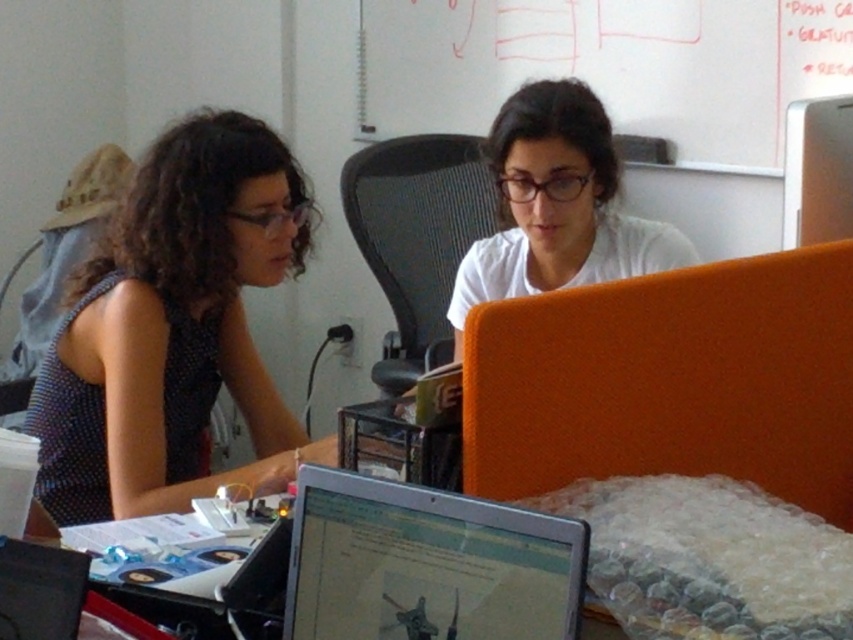
You are organizing a clothing donation drive and need to determine which shirt takes up more space. Based on the image, which of the two shirts, the polka dot fabric shirt at left or the white matte shirt at center, is bigger in size?

The polka dot fabric shirt at left has a larger size compared to the white matte shirt at center, so the polka dot fabric shirt at left takes up more space.

You are a delivery robot with a package that needs to be placed on the table between the metallic silver laptop at lower center and the white matte shirt at center. The package is 30 inches long. Will it fit in the space between them?

The distance between the metallic silver laptop at lower center and the white matte shirt at center is 35.05 inches. Since the package is 30 inches long, it will fit in the space between them.